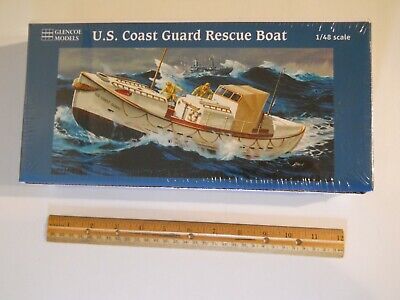
I want to click on wooden ruler, so (x=204, y=235).